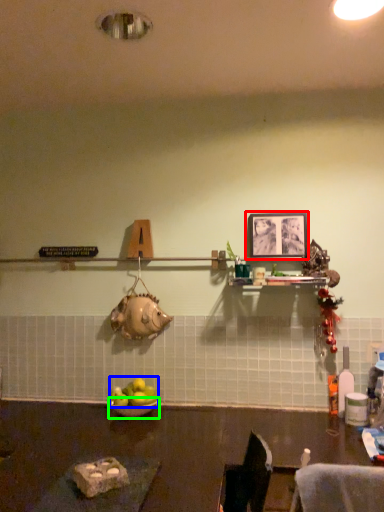
Question: Which object is the farthest from picture frame (highlighted by a red box)? Choose among these: apple (highlighted by a blue box) or bowl (highlighted by a green box).

Choices:
 (A) apple
 (B) bowl

Answer: (B)